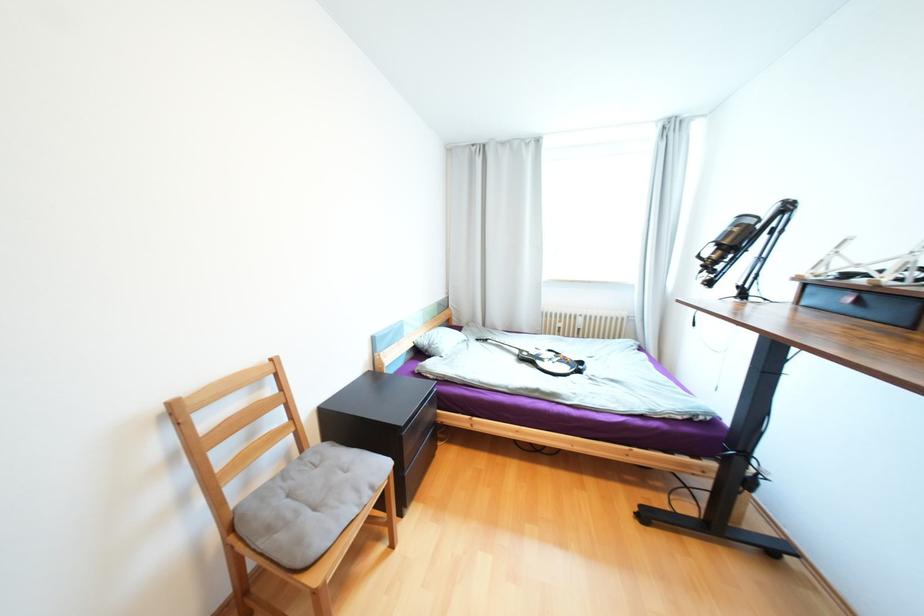
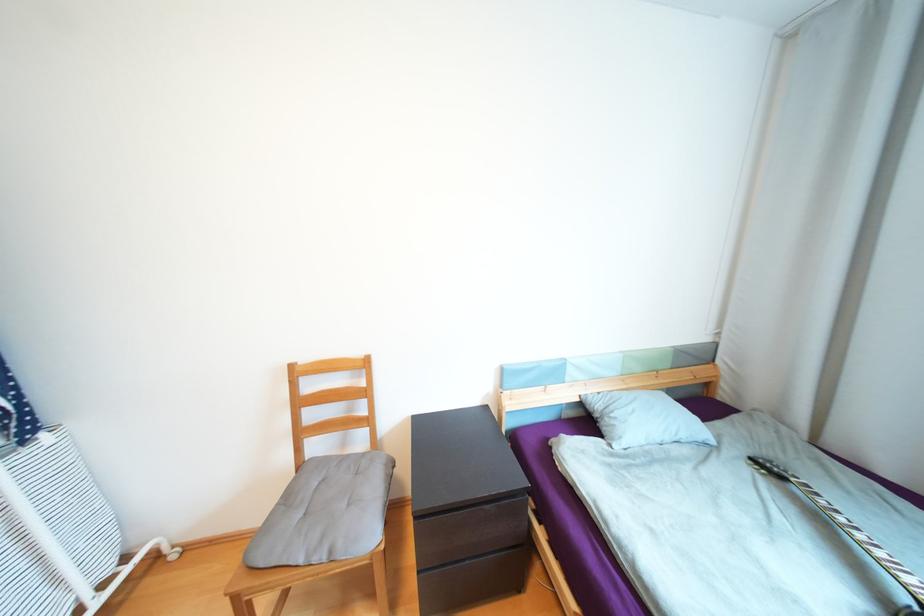
In the second image, find the point that corresponds to [378,488] in the first image.

(335, 553)